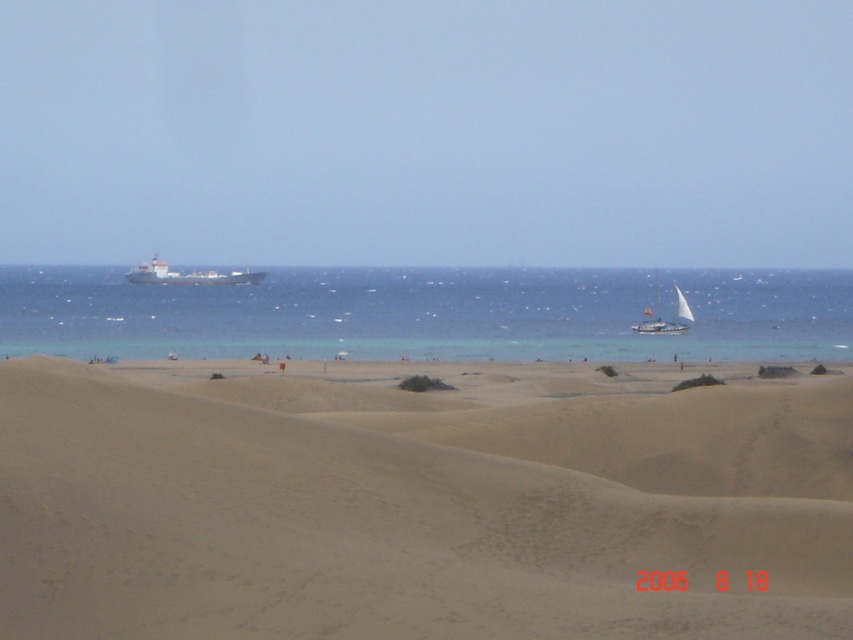
Is blue water at center thinner than metallic gray ship at center-left?

In fact, blue water at center might be wider than metallic gray ship at center-left.

Does point (78, 288) come in front of point (154, 253)?

That is True.

The width and height of the screenshot is (853, 640). I want to click on blue water at center, so click(x=428, y=314).

Can you confirm if light brown sand at center is thinner than blue water at center?

Yes.

Is the position of light brown sand at center more distant than that of blue water at center?

No, it is in front of blue water at center.

Between point (840, 609) and point (666, 349), which one is positioned behind?

The point (666, 349) is behind.

Locate an element on the screen. This screenshot has height=640, width=853. light brown sand at center is located at coordinates (419, 502).

Who is higher up, light brown sand at center or white sailboat at center?

white sailboat at center is above.

Is point (103, 540) in front of point (648, 328)?

Yes, it is.

Does point (15, 396) come behind point (663, 332)?

No.

Identify the location of light brown sand at center. (419, 502).